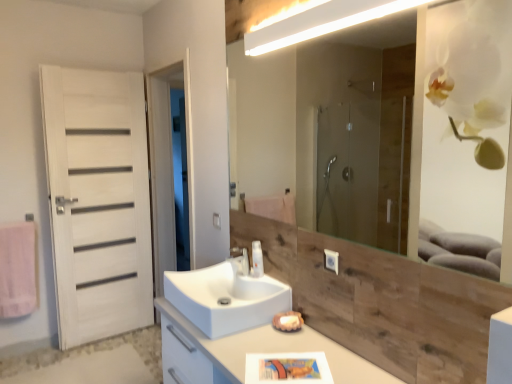
Identify the location of vacant area that is in front of white glossy sink at center. [x=259, y=352].